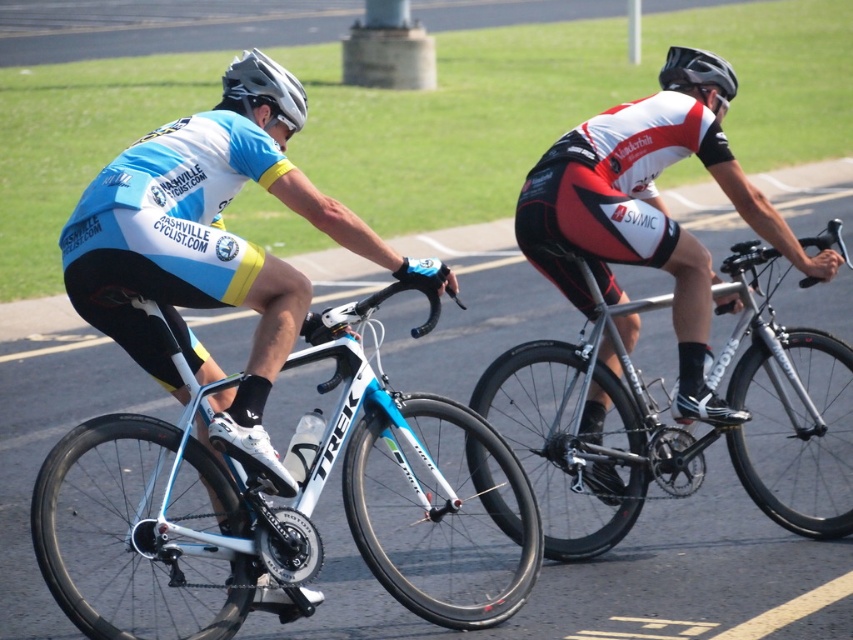
Consider the image. You are a photographer positioned at the starting line of the race. You want to capture a photo of the silver metallic bicycle at center and the black matte helmet at upper center. Which object should you focus on first if you want to include both in your shot without moving the camera?

The silver metallic bicycle at center is located below the black matte helmet at upper center, so you should focus on the black matte helmet at upper center first to ensure both are in frame without moving the camera.

You are a photographer standing at the origin point of the image. You want to take a picture of the matte white bicycle at center. Which direction should you move to get closer to it?

Since the matte white bicycle at center is located at coordinate point (271, 512), you should move towards the right and upwards from your current position at the origin to get closer to it.

You are a photographer positioned at the starting line of a cycling event. You want to capture a photo of both the matte white bicycle at center and the matte gray helmet at upper left. Based on their positions, which object will appear larger in your photo?

The matte white bicycle at center will appear larger in the photo because it is closer to the viewer than the matte gray helmet at upper left, making it appear bigger in the frame.